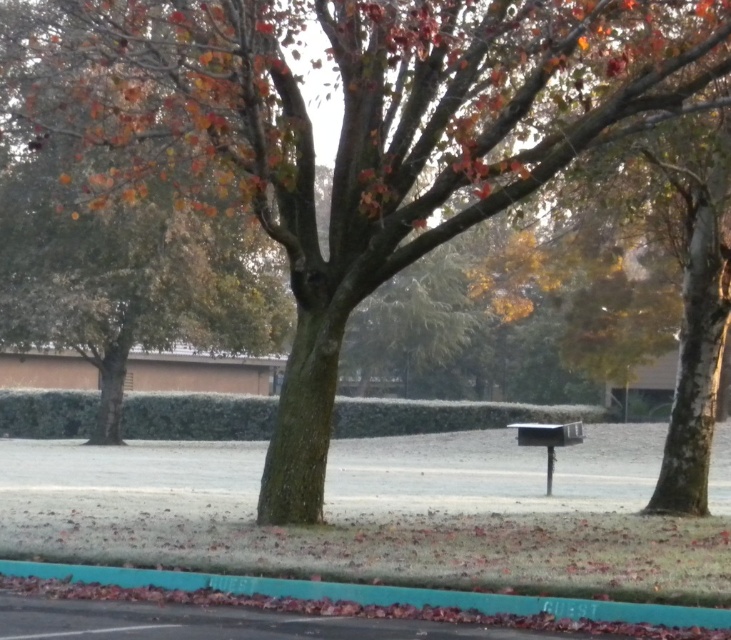
Question: From the image, what is the correct spatial relationship of teal rubber curb at lower center in relation to metallic silver mailbox at center?

Choices:
 (A) below
 (B) above

Answer: (B)

Question: Can you confirm if teal rubber curb at lower center is bigger than metallic silver mailbox at center?

Choices:
 (A) yes
 (B) no

Answer: (B)

Question: Which of the following is the farthest from the observer?

Choices:
 (A) metallic silver mailbox at center
 (B) teal rubber curb at lower center

Answer: (A)

Question: Is teal rubber curb at lower center closer to camera compared to metallic silver mailbox at center?

Choices:
 (A) yes
 (B) no

Answer: (A)

Question: Which point is closer to the camera?

Choices:
 (A) (553, 442)
 (B) (529, 609)

Answer: (B)